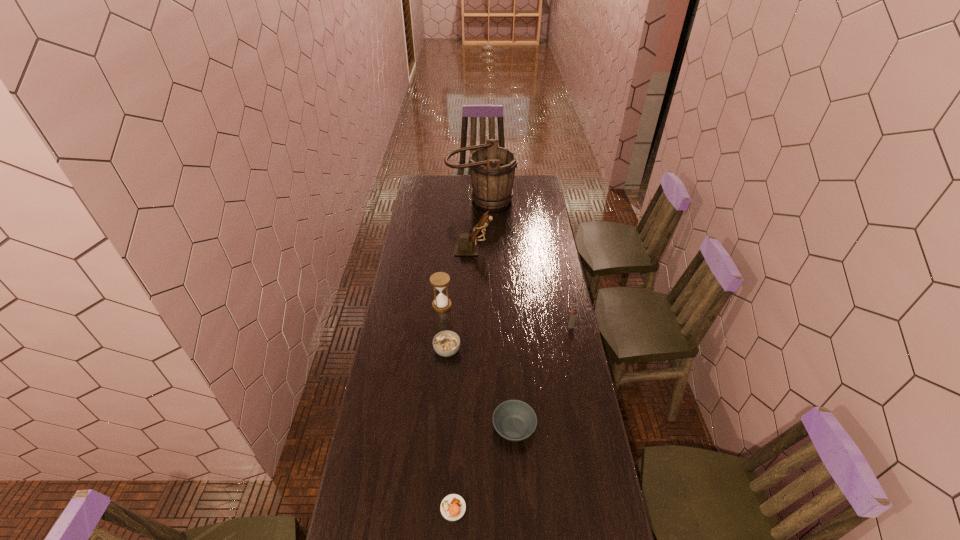
Locate an element on the screen. The height and width of the screenshot is (540, 960). vacant point located on the left of the nearest object is located at coordinates (387, 508).

This screenshot has width=960, height=540. I want to click on object at the far edge, so click(x=492, y=168).

Image resolution: width=960 pixels, height=540 pixels. I want to click on object present at the right edge, so click(573, 315).

The height and width of the screenshot is (540, 960). What are the coordinates of `free location at the far edge` in the screenshot? It's located at (463, 181).

Where is `vacant space at the left edge`? The image size is (960, 540). vacant space at the left edge is located at coordinates (418, 232).

Where is `blank space at the right edge of the desktop`? This screenshot has height=540, width=960. blank space at the right edge of the desktop is located at coordinates (541, 273).

Where is `free space at the far right corner of the desktop`? Image resolution: width=960 pixels, height=540 pixels. free space at the far right corner of the desktop is located at coordinates [x=521, y=179].

Where is `free space between the patty and the farthest object`? The height and width of the screenshot is (540, 960). free space between the patty and the farthest object is located at coordinates (467, 353).

This screenshot has height=540, width=960. I want to click on free area in between the rightmost object and the sixth shortest object, so click(522, 288).

Where is `unoccupied area between the sixth nearest object and the fourth nearest object`? unoccupied area between the sixth nearest object and the fourth nearest object is located at coordinates (522, 288).